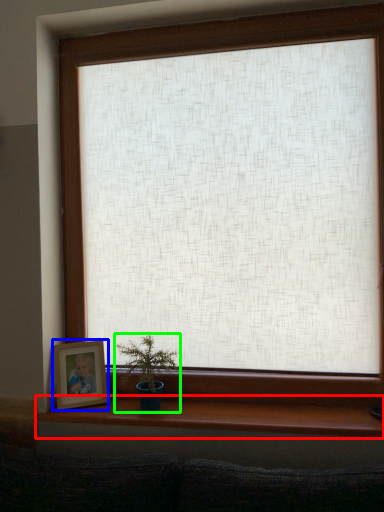
Question: Which object is the farthest from window sill (highlighted by a red box)? Choose among these: picture frame (highlighted by a blue box) or houseplant (highlighted by a green box).

Choices:
 (A) picture frame
 (B) houseplant

Answer: (A)